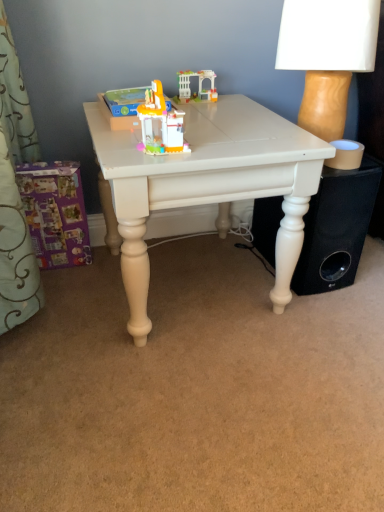
Where is `free space in front of translucent plastic toy at center, which is counted as the 4th toy, starting from the back`? free space in front of translucent plastic toy at center, which is counted as the 4th toy, starting from the back is located at coordinates (150, 159).